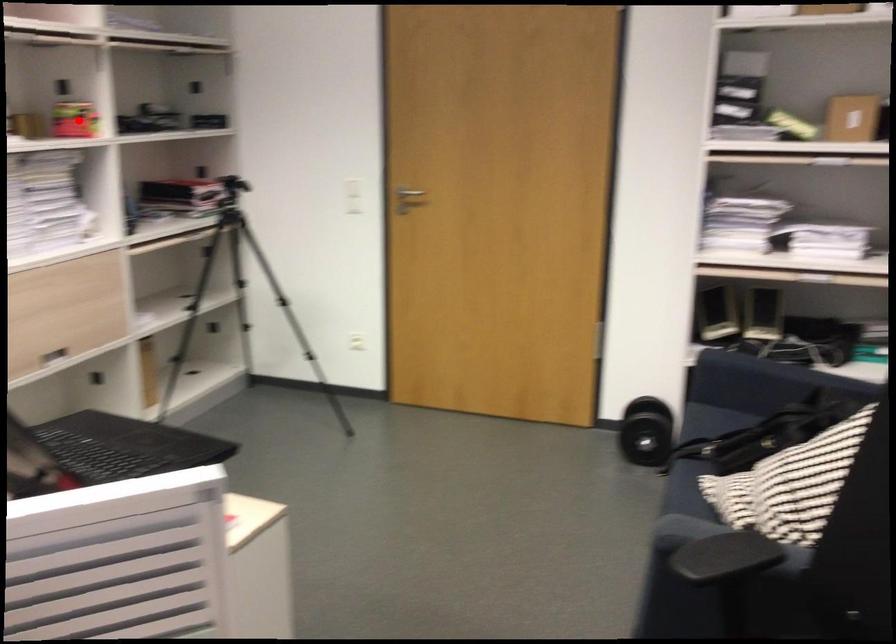
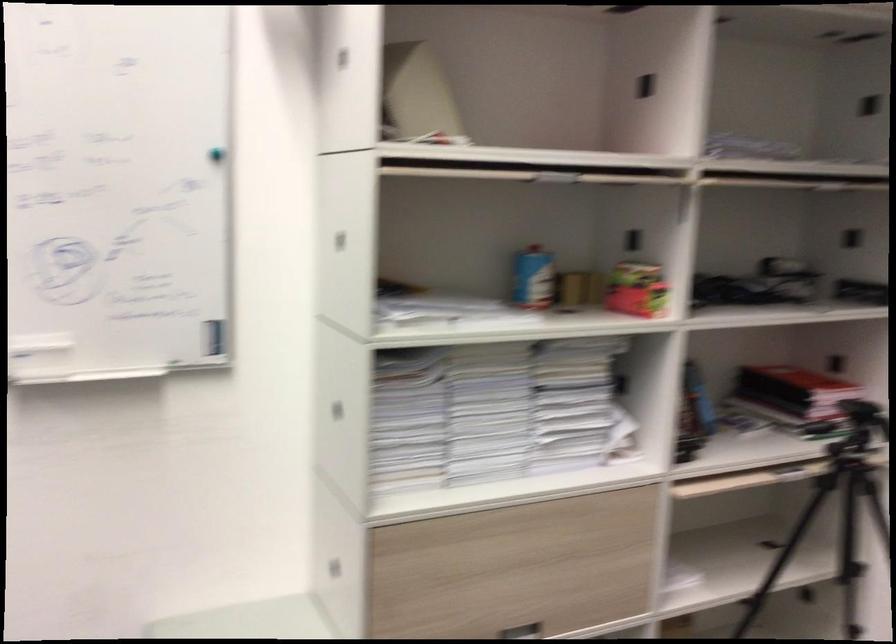
Question: I am providing you with two images of the same scene from different viewpoints. A red point is shown in image1. For the corresponding object point in image2, is it positioned nearer or farther from the camera?

Choices:
 (A) Nearer
 (B) Farther

Answer: (A)